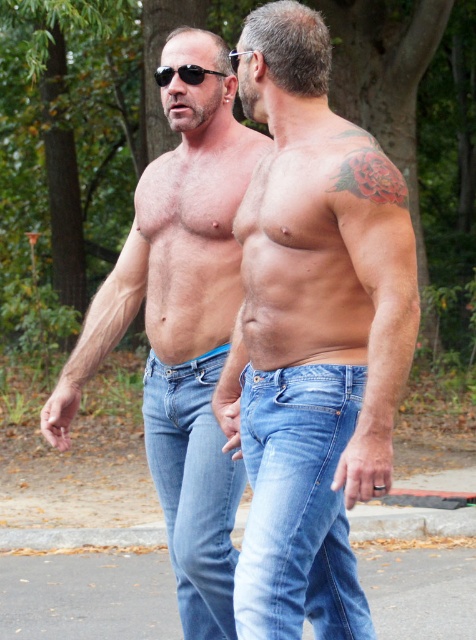
Which is below, smooth skin torso at center or matte blue jeans at center?

Positioned lower is matte blue jeans at center.

Is smooth skin torso at center taller than matte blue jeans at center?

No.

Which is behind, point (300, 208) or point (147, 317)?

The point (147, 317) is behind.

The image size is (476, 640). In order to click on smooth skin torso at center in this screenshot , I will do `click(311, 333)`.

Does point (293, 141) come closer to viewer compared to point (165, 67)?

Yes.

Between point (297, 500) and point (218, 72), which one is positioned behind?

The point (218, 72) is behind.

This screenshot has height=640, width=476. Identify the location of smooth skin torso at center. (311, 333).

This screenshot has height=640, width=476. What do you see at coordinates (311, 333) in the screenshot?
I see `smooth skin torso at center` at bounding box center [311, 333].

Which is in front, point (283, 156) or point (185, 620)?

Point (283, 156)

At what (x,y) coordinates should I click in order to perform the action: click on smooth skin torso at center. Please return your answer as a coordinate pair (x, y). Looking at the image, I should click on (311, 333).

Locate an element on the screen. smooth skin torso at center is located at coordinates (311, 333).